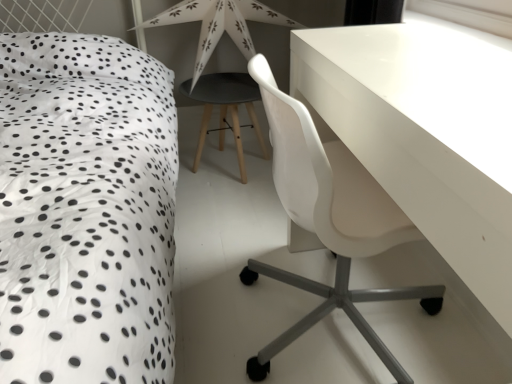
Image resolution: width=512 pixels, height=384 pixels. What do you see at coordinates (214, 25) in the screenshot? I see `white paper star at upper center` at bounding box center [214, 25].

This screenshot has width=512, height=384. Identify the location of white dotted fabric at left. (86, 211).

Describe the element at coordinates (86, 211) in the screenshot. I see `white dotted fabric at left` at that location.

Locate an element on the screen. Image resolution: width=512 pixels, height=384 pixels. white paper star at upper center is located at coordinates (214, 25).

From the image's perspective, is white dotted fabric at left under white glossy table at upper right?

No.

What's the angular difference between white dotted fabric at left and white glossy table at upper right's facing directions?

white dotted fabric at left and white glossy table at upper right are facing 89.2 degrees away from each other.

Is white glossy table at upper right a part of white dotted fabric at left?

No, white glossy table at upper right is not a part of white dotted fabric at left.

Which of these two, white dotted fabric at left or white glossy table at upper right, is thinner?

With smaller width is white glossy table at upper right.

From a real-world perspective, is white paper star at upper center positioned above or below white glossy table at upper right?

Clearly, from a real-world perspective, white paper star at upper center is above white glossy table at upper right.

Between white paper star at upper center and white glossy table at upper right, which one has larger width?

white glossy table at upper right is wider.

From the image's perspective, between white paper star at upper center and white glossy table at upper right, who is located below?

white glossy table at upper right, from the image's perspective.

In terms of height, does white paper star at upper center look taller or shorter compared to white glossy table at upper right?

Considering their sizes, white paper star at upper center has less height than white glossy table at upper right.

Does white glossy table at upper right appear on the right side of white dotted fabric at left?

Correct, you'll find white glossy table at upper right to the right of white dotted fabric at left.

Locate an element on the screen. The image size is (512, 384). bed above the white glossy table at upper right (from a real-world perspective) is located at coordinates (86, 211).

In the scene shown: Is white glossy table at upper right positioned beyond the bounds of white dotted fabric at left?

white glossy table at upper right lies outside white dotted fabric at left's area.

Is white glossy table at upper right looking in the opposite direction of white dotted fabric at left?

white glossy table at upper right does not have its back to white dotted fabric at left.

Is white glossy table at upper right completely or partially outside of matte black stool at center?

white glossy table at upper right lies outside matte black stool at center's area.

How different are the orientations of white glossy table at upper right and matte black stool at center in degrees?

They differ by 88.8 degrees in their facing directions.

Can you confirm if white glossy table at upper right is shorter than matte black stool at center?

No, white glossy table at upper right is not shorter than matte black stool at center.

Is white glossy table at upper right not close to matte black stool at center?

No, white glossy table at upper right is not far from matte black stool at center.

In the image, is white paper star at upper center positioned in front of or behind matte black stool at center?

white paper star at upper center is in front of matte black stool at center.

Do you think white paper star at upper center is within matte black stool at center, or outside of it?

The correct answer is: outside.

Is white paper star at upper center aimed at matte black stool at center?

No, white paper star at upper center is not oriented towards matte black stool at center.

From the image's perspective, between white paper star at upper center and matte black stool at center, who is located below?

matte black stool at center is shown below in the image.

What's the angular difference between transparent plastic window screen at upper right and white paper star at upper center's facing directions?

The facing directions of transparent plastic window screen at upper right and white paper star at upper center are 90.7 degrees apart.

I want to click on window screen lying on the right of white paper star at upper center, so click(467, 19).

Considering the relative sizes of transparent plastic window screen at upper right and white paper star at upper center in the image provided, is transparent plastic window screen at upper right taller than white paper star at upper center?

No, transparent plastic window screen at upper right is not taller than white paper star at upper center.

Can you confirm if transparent plastic window screen at upper right is positioned to the left of white paper star at upper center?

Incorrect, transparent plastic window screen at upper right is not on the left side of white paper star at upper center.

From the image's perspective, which object appears higher, matte black stool at center or white paper star at upper center?

white paper star at upper center, from the image's perspective.

Identify the location of bar stool below the white paper star at upper center (from a real-world perspective). This screenshot has height=384, width=512. (226, 109).

From a real-world perspective, is matte black stool at center physically located above or below white paper star at upper center?

Clearly, from a real-world perspective, matte black stool at center is below white paper star at upper center.

Are matte black stool at center and white paper star at upper center beside each other?

Absolutely, matte black stool at center is next to and touching white paper star at upper center.

I want to click on bed on the left of white glossy table at upper right, so click(x=86, y=211).

I want to click on table to the right of white paper star at upper center, so click(x=425, y=133).

Looking at the image, which one is located further to transparent plastic window screen at upper right, white paper star at upper center or matte black stool at center?

matte black stool at center is further to transparent plastic window screen at upper right.

Considering their positions, is white glossy table at upper right positioned further to transparent plastic window screen at upper right than matte black stool at center?

The object further to transparent plastic window screen at upper right is matte black stool at center.

Based on the photo, which object lies nearer to the anchor point matte black stool at center, transparent plastic window screen at upper right or white dotted fabric at left?

Among the two, white dotted fabric at left is located nearer to matte black stool at center.

Based on their spatial positions, is white dotted fabric at left or matte black stool at center further from white paper star at upper center?

The object further to white paper star at upper center is white dotted fabric at left.

Considering their positions, is transparent plastic window screen at upper right positioned further to white dotted fabric at left than matte black stool at center?

transparent plastic window screen at upper right lies further to white dotted fabric at left than the other object.

From the image, which object appears to be nearer to white glossy table at upper right, transparent plastic window screen at upper right or matte black stool at center?

transparent plastic window screen at upper right is positioned closer to the anchor white glossy table at upper right.

Which object lies nearer to the anchor point white glossy table at upper right, matte black stool at center or transparent plastic window screen at upper right?

Among the two, transparent plastic window screen at upper right is located nearer to white glossy table at upper right.

Based on their spatial positions, is matte black stool at center or white glossy table at upper right further from white paper star at upper center?

white glossy table at upper right is further to white paper star at upper center.

Where is `window screen located between white glossy table at upper right and matte black stool at center in the depth direction`? The height and width of the screenshot is (384, 512). window screen located between white glossy table at upper right and matte black stool at center in the depth direction is located at coordinates (467, 19).

Where is `window screen between white glossy table at upper right and white paper star at upper center from front to back`? This screenshot has height=384, width=512. window screen between white glossy table at upper right and white paper star at upper center from front to back is located at coordinates (467, 19).

Locate an element on the screen. This screenshot has height=384, width=512. table lamp positioned between white dotted fabric at left and matte black stool at center from near to far is located at coordinates (214, 25).

Find the location of a particular element. This screenshot has height=384, width=512. table between white dotted fabric at left and transparent plastic window screen at upper right in the horizontal direction is located at coordinates (425, 133).